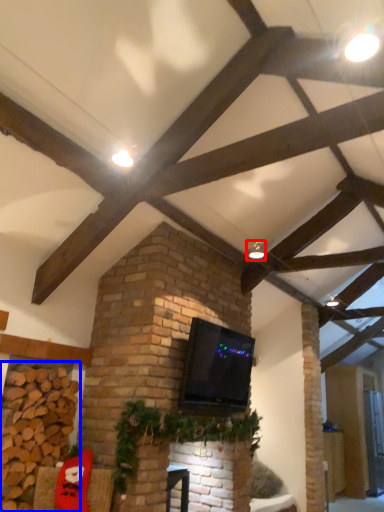
Question: Which of the following is the closest to the observer, light fixture (highlighted by a red box) or brickwork (highlighted by a blue box)?

Choices:
 (A) light fixture
 (B) brickwork

Answer: (B)